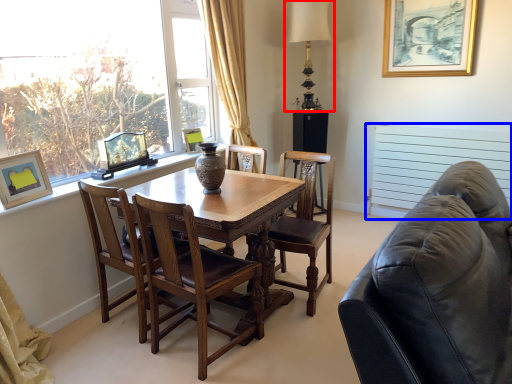
Question: Which object is closer to the camera taking this photo, table lamp (highlighted by a red box) or radiator (highlighted by a blue box)?

Choices:
 (A) table lamp
 (B) radiator

Answer: (B)